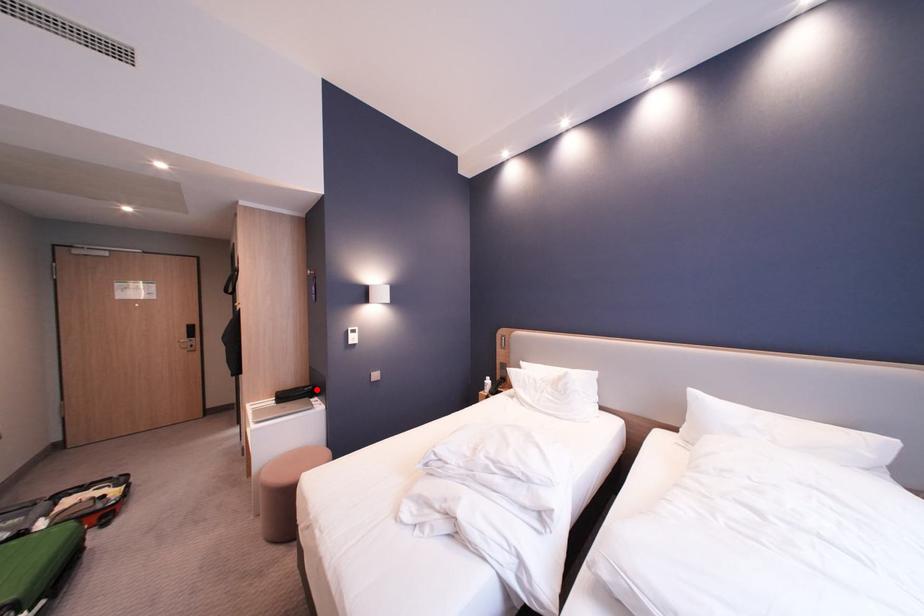
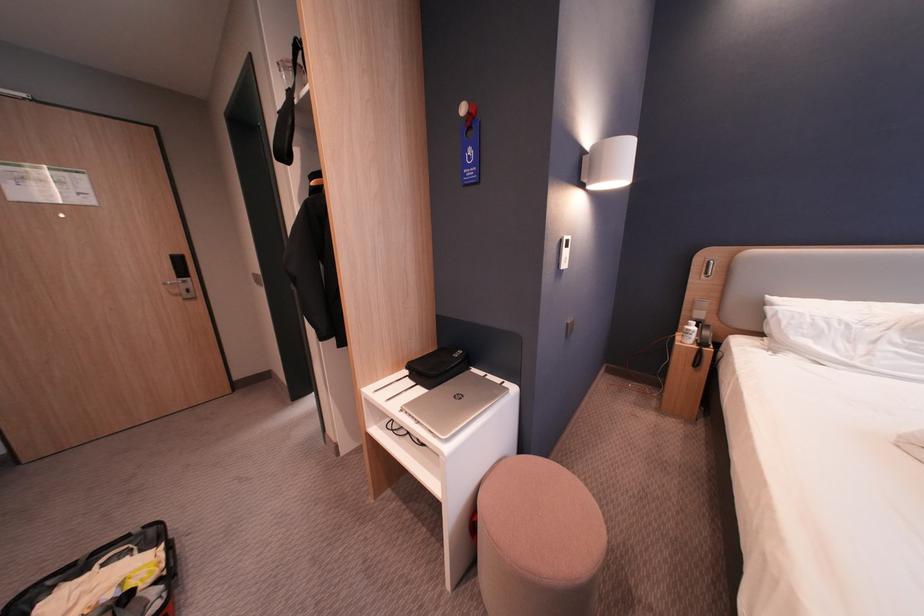
Find the pixel in the second image that matches the highlighted location in the first image.

(467, 357)